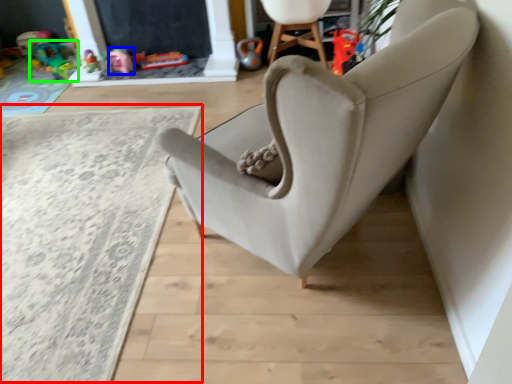
Question: Which is nearer to the plain (highlighted by a red box)? toy (highlighted by a blue box) or toy (highlighted by a green box).

Choices:
 (A) toy
 (B) toy

Answer: (A)